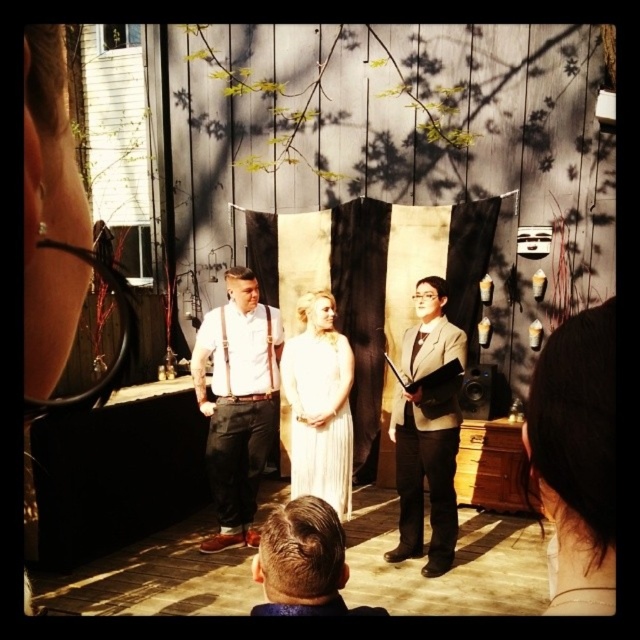
Question: Can you confirm if matte white shirt at center is smaller than black satin tie at center?

Choices:
 (A) no
 (B) yes

Answer: (A)

Question: Does brown hair at center have a lesser width compared to black satin tie at center?

Choices:
 (A) yes
 (B) no

Answer: (B)

Question: Which point is farther from the camera taking this photo?

Choices:
 (A) (584, 323)
 (B) (448, 328)

Answer: (B)

Question: Which point is closer to the camera?

Choices:
 (A) matte white shirt at center
 (B) brown hair at center
 (C) black satin tie at center

Answer: (B)

Question: Can you confirm if matte white shirt at center is thinner than white satin dress at center?

Choices:
 (A) no
 (B) yes

Answer: (A)

Question: Based on their relative distances, which object is farther from the matte white shirt at center?

Choices:
 (A) black satin tie at center
 (B) brown hair at center

Answer: (B)